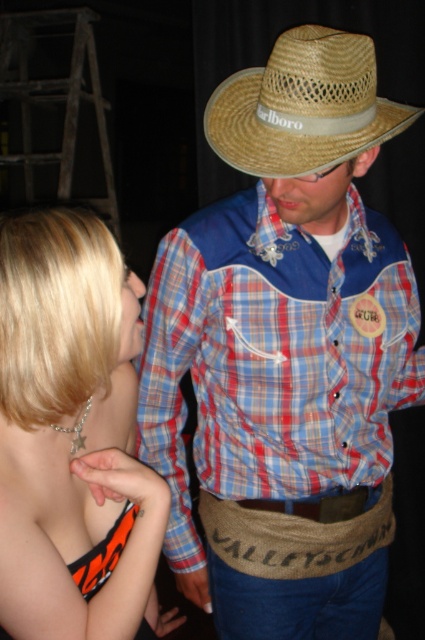
Question: Does shiny silver necklace at upper left have a smaller size compared to strawmaterial/texturecowboy hat at upper center?

Choices:
 (A) yes
 (B) no

Answer: (B)

Question: Does matte straw cowboy hat at center have a lesser width compared to shiny silver necklace at upper left?

Choices:
 (A) yes
 (B) no

Answer: (B)

Question: Is matte straw cowboy hat at center to the right of strawmaterial/texturecowboy hat at upper center from the viewer's perspective?

Choices:
 (A) no
 (B) yes

Answer: (B)

Question: Which point appears farthest from the camera in this image?

Choices:
 (A) (240, 396)
 (B) (133, 536)
 (C) (283, 45)

Answer: (A)

Question: Which is nearer to the strawmaterial/texturecowboy hat at upper center?

Choices:
 (A) matte straw cowboy hat at center
 (B) shiny silver necklace at upper left

Answer: (A)

Question: Among these objects, which one is nearest to the camera?

Choices:
 (A) shiny silver necklace at upper left
 (B) matte straw cowboy hat at center
 (C) strawmaterial/texturecowboy hat at upper center

Answer: (A)